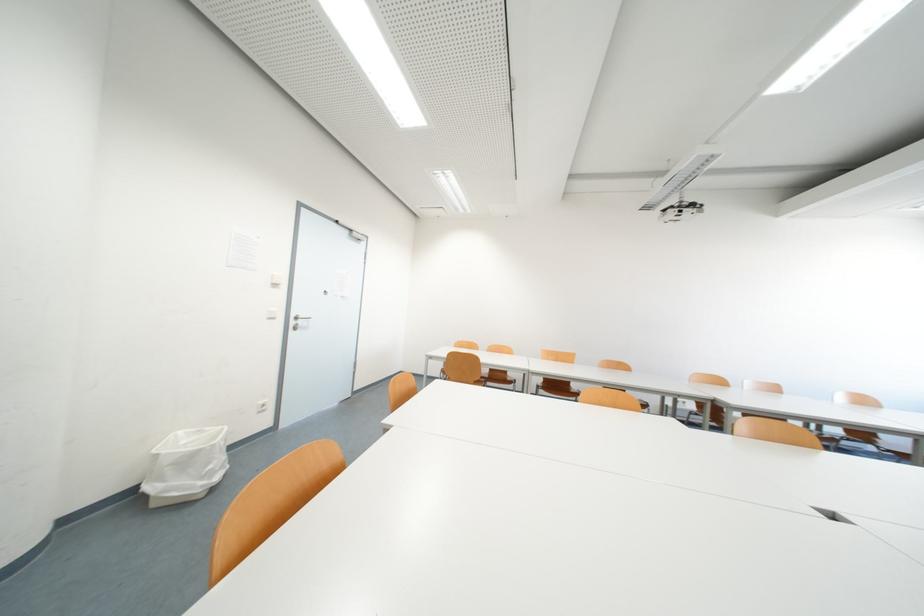
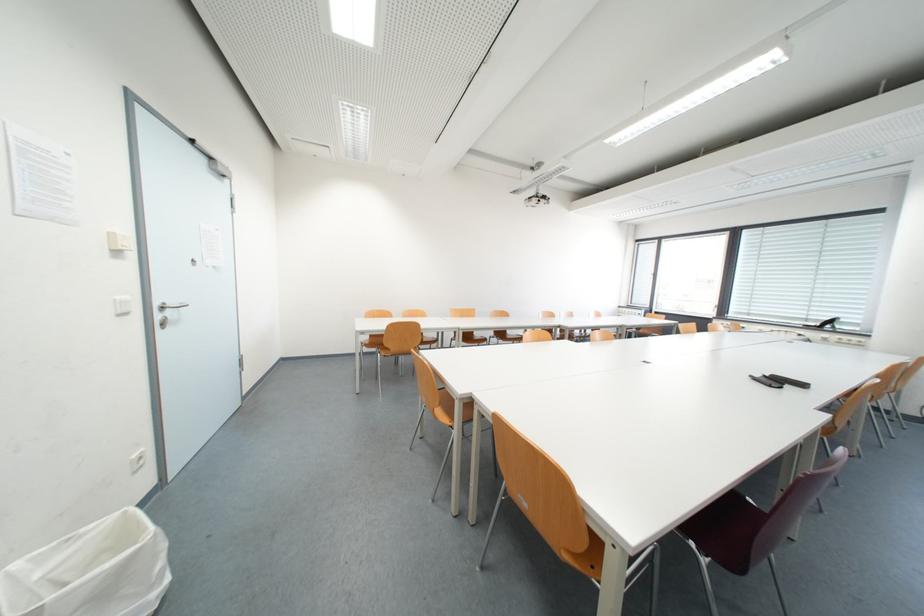
In the second image, find the point that corresponds to [283,277] in the first image.

(122, 236)